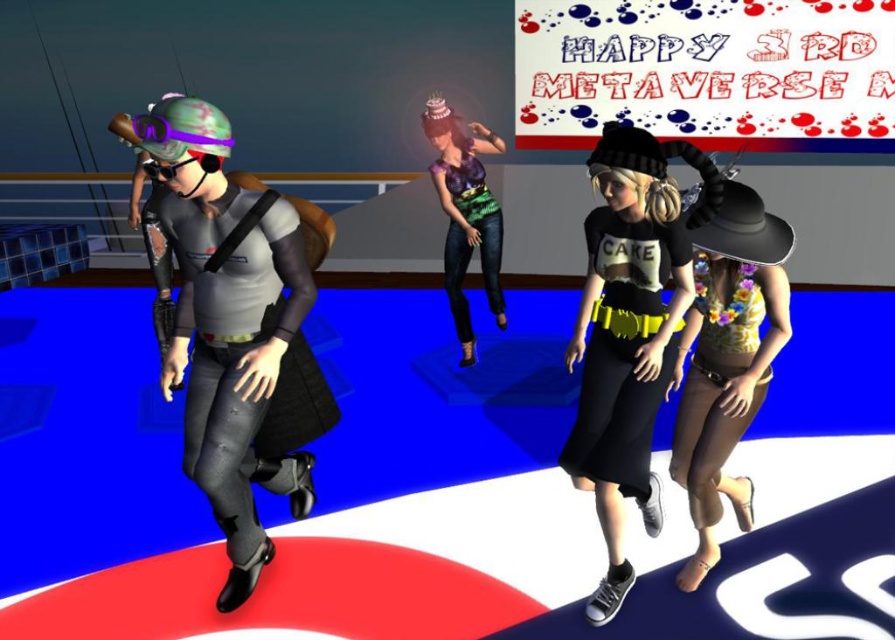
Question: Is the position of shiny metallic helmet at left more distant than that of shiny purple tank top at center?

Choices:
 (A) no
 (B) yes

Answer: (A)

Question: Is shiny metallic helmet at left to the left of black matte t-shirt at center from the viewer's perspective?

Choices:
 (A) no
 (B) yes

Answer: (B)

Question: Is the position of shiny metallic helmet at left less distant than that of floral yellow tank top at center?

Choices:
 (A) yes
 (B) no

Answer: (A)

Question: Among these points, which one is nearest to the camera?

Choices:
 (A) (483, 276)
 (B) (205, 276)
 (C) (739, 502)

Answer: (B)

Question: Estimate the real-world distances between objects in this image. Which object is farther from the shiny purple tank top at center?

Choices:
 (A) shiny metallic helmet at left
 (B) black matte t-shirt at center
 (C) floral yellow tank top at center

Answer: (A)

Question: Which object is positioned closest to the shiny metallic helmet at left?

Choices:
 (A) black matte t-shirt at center
 (B) floral yellow tank top at center
 (C) shiny purple tank top at center

Answer: (A)